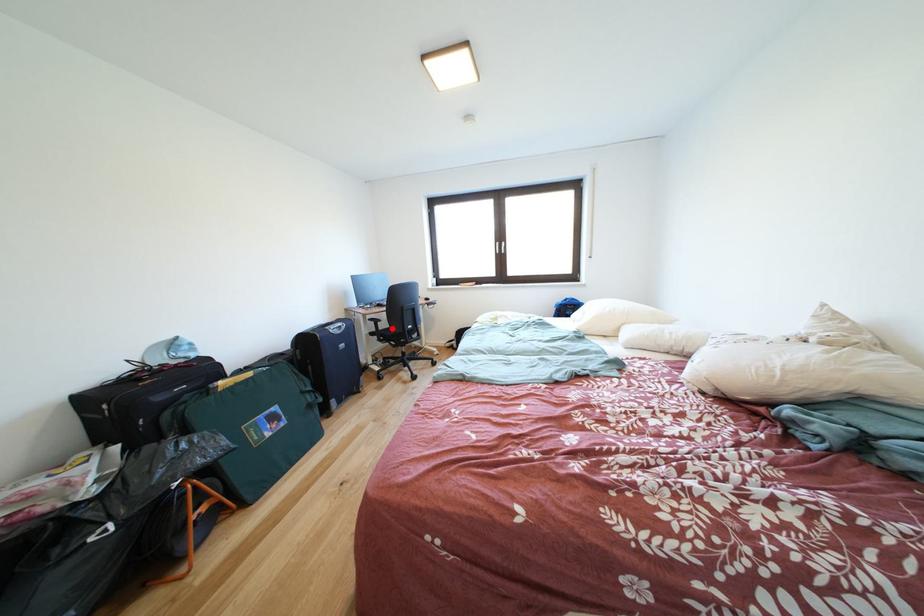
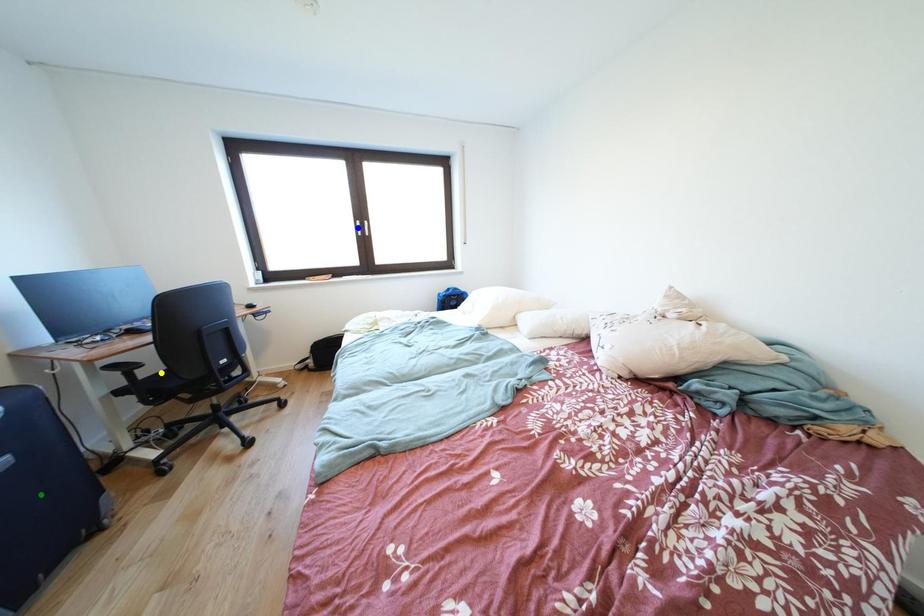
Question: I am providing you with two images of the same scene from different viewpoints. A red point is marked on the first image. You are given multiple points on the second image. In image 2, which mark is for the same physical point as the one in image 1?

Choices:
 (A) yellow point
 (B) blue point
 (C) green point

Answer: (A)